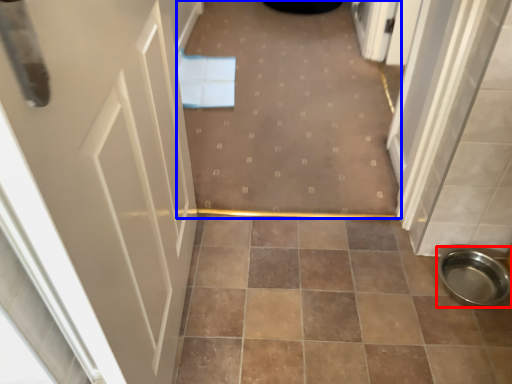
Question: Which of the following is the farthest to the observer, toilet bowl (highlighted by a red box) or plain (highlighted by a blue box)?

Choices:
 (A) toilet bowl
 (B) plain

Answer: (B)